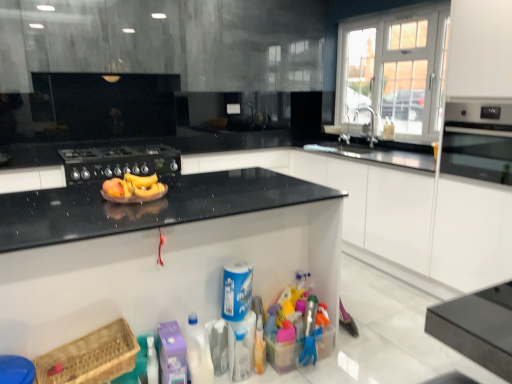
Question: Is blue plastic canister at center, marked as the 2th cleaning product in a right-to-left arrangement, wider or thinner than matte black oven at right?

Choices:
 (A) thin
 (B) wide

Answer: (A)

Question: Is blue plastic canister at center, the 3th cleaning product from the left, situated inside matte black oven at right or outside?

Choices:
 (A) inside
 (B) outside

Answer: (B)

Question: Which object is the farthest from the brown woven basket at lower left?

Choices:
 (A) white plastic bottle at lower center, which is the 2th cleaning product from left to right
 (B) purple plastic container at lower center, acting as the first cleaning product starting from the left
 (C) white glossy cabinet at lower center, acting as the 2th cabinetry starting from the back
 (D) black matte gas stove at center
 (E) silver metallic faucet at upper right

Answer: (E)

Question: Which object is positioned farthest from the matte black oven at right?

Choices:
 (A) silver metallic faucet at upper right
 (B) translucent plastic spray bottle at lower center, the first cleaning product from the right
 (C) translucent plastic bottle at lower center
 (D) black matte gas stove at center
 (E) white glossy cabinet at lower center, acting as the 2th cabinetry starting from the back

Answer: (D)